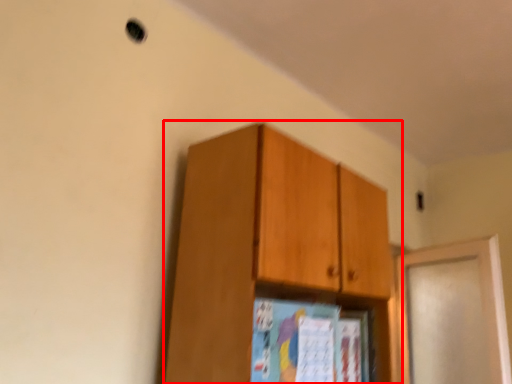
Question: Where is cabinetry (annotated by the red box) located in relation to door in the image?

Choices:
 (A) right
 (B) left

Answer: (B)